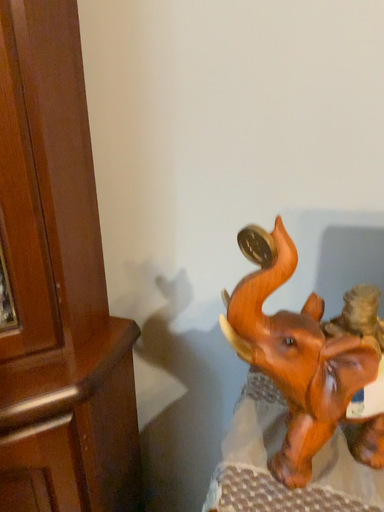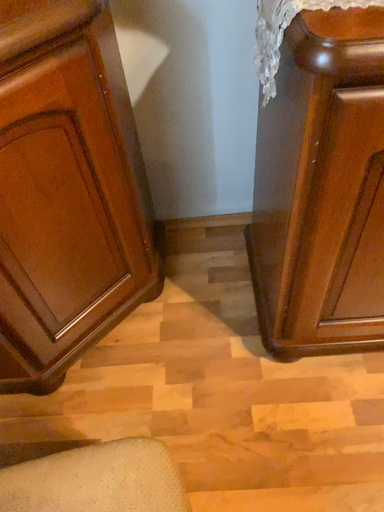
Question: How did the camera likely rotate when shooting the video?

Choices:
 (A) rotated right
 (B) rotated left

Answer: (A)